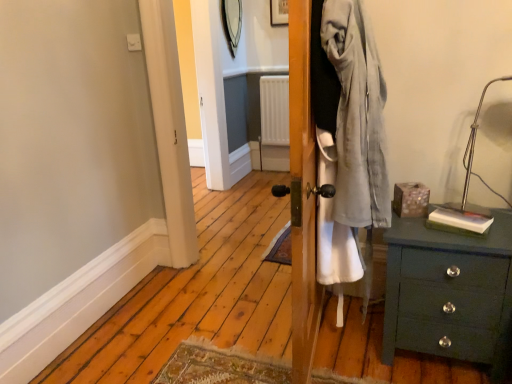
Question: Is green wood chest of drawers at lower right far away from wooden picture frame at upper center?

Choices:
 (A) yes
 (B) no

Answer: (A)

Question: From the image's perspective, is green wood chest of drawers at lower right on top of wooden picture frame at upper center?

Choices:
 (A) yes
 (B) no

Answer: (B)

Question: Is green wood chest of drawers at lower right bigger than wooden picture frame at upper center?

Choices:
 (A) yes
 (B) no

Answer: (A)

Question: From the image's perspective, is green wood chest of drawers at lower right located beneath wooden picture frame at upper center?

Choices:
 (A) no
 (B) yes

Answer: (B)

Question: Can you confirm if green wood chest of drawers at lower right is smaller than wooden picture frame at upper center?

Choices:
 (A) no
 (B) yes

Answer: (A)

Question: From a real-world perspective, relative to metallic silver mirror at upper center, is green wood chest of drawers at lower right vertically above or below?

Choices:
 (A) below
 (B) above

Answer: (A)

Question: Visually, is green wood chest of drawers at lower right positioned to the left or to the right of metallic silver mirror at upper center?

Choices:
 (A) left
 (B) right

Answer: (B)

Question: Which is correct: green wood chest of drawers at lower right is inside metallic silver mirror at upper center, or outside of it?

Choices:
 (A) inside
 (B) outside

Answer: (B)

Question: From the image's perspective, is green wood chest of drawers at lower right above or below metallic silver mirror at upper center?

Choices:
 (A) below
 (B) above

Answer: (A)

Question: From a real-world perspective, is metallic silver table lamp at upper right above or below wooden picture frame at upper center?

Choices:
 (A) below
 (B) above

Answer: (A)

Question: Considering the positions of point (473, 127) and point (273, 11), is point (473, 127) closer or farther from the camera than point (273, 11)?

Choices:
 (A) farther
 (B) closer

Answer: (B)

Question: From the image's perspective, is metallic silver table lamp at upper right above or below wooden picture frame at upper center?

Choices:
 (A) below
 (B) above

Answer: (A)

Question: Choose the correct answer: Is metallic silver table lamp at upper right inside wooden picture frame at upper center or outside it?

Choices:
 (A) outside
 (B) inside

Answer: (A)

Question: Visually, is wooden picture frame at upper center positioned to the left or to the right of metallic silver mirror at upper center?

Choices:
 (A) left
 (B) right

Answer: (B)

Question: Is point (273, 3) closer or farther from the camera than point (236, 48)?

Choices:
 (A) farther
 (B) closer

Answer: (A)